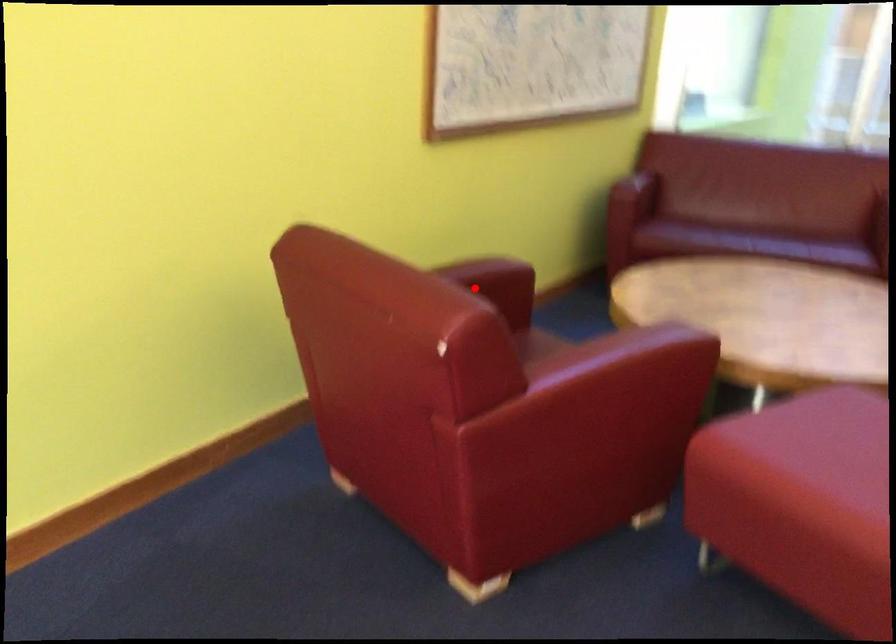
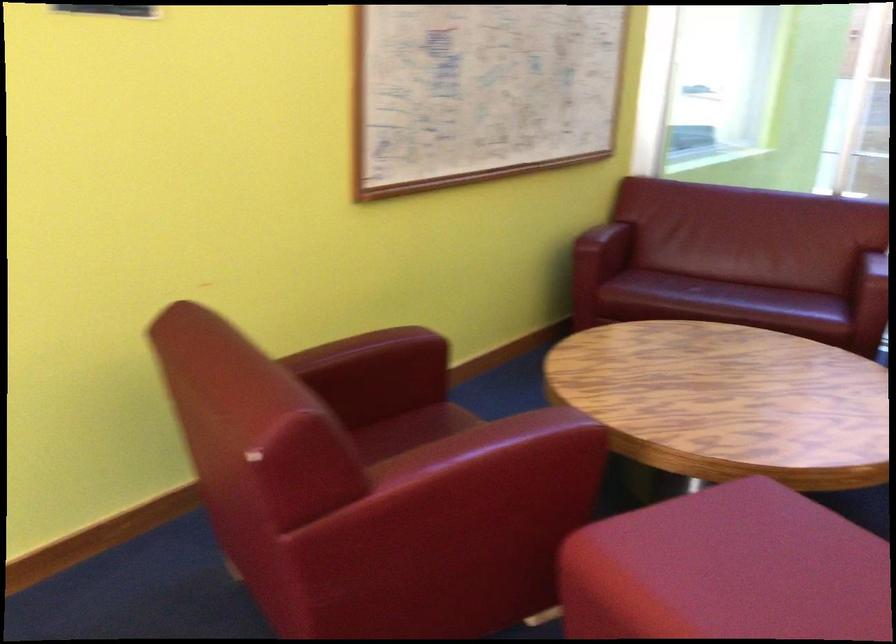
Where in the second image is the point corresponding to the highlighted location from the first image?

(375, 363)